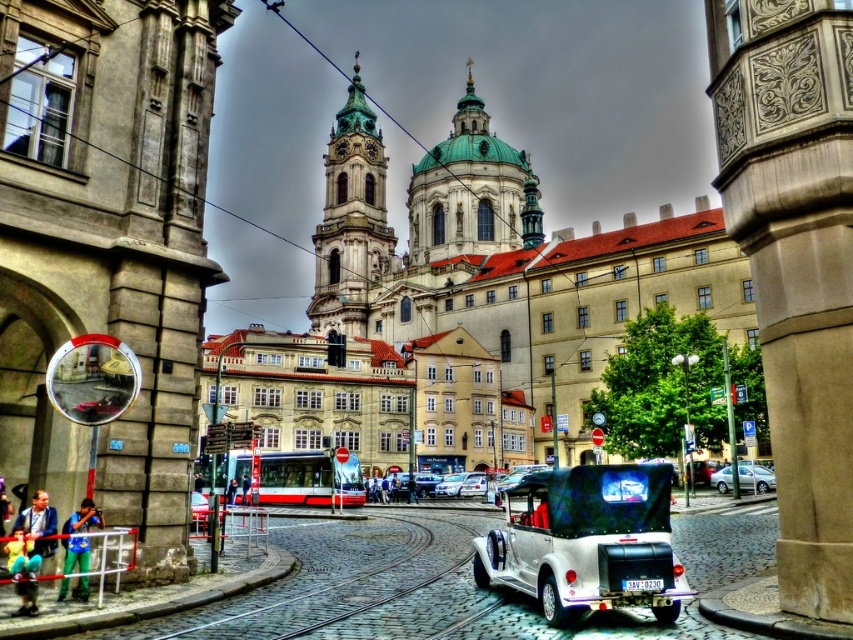
Question: Which is nearer to the silver metallic sedan at lower right?

Choices:
 (A) green glazed tile dome at center
 (B) brown textured pillar at center right

Answer: (B)

Question: Can you confirm if metallic silver car at center is positioned to the left of silver metallic sedan at lower right?

Choices:
 (A) no
 (B) yes

Answer: (B)

Question: Does metallic silver car at center have a greater width compared to green glazed tile bell tower at center?

Choices:
 (A) no
 (B) yes

Answer: (A)

Question: Among these objects, which one is nearest to the camera?

Choices:
 (A) green glazed tile bell tower at center
 (B) silver metallic sedan at lower right

Answer: (B)

Question: Which point is farther to the camera?

Choices:
 (A) metallic silver car at center
 (B) green glazed tile bell tower at center
 (C) brown textured pillar at center right

Answer: (B)

Question: Where is brown textured pillar at center right located in relation to green glazed tile dome at center in the image?

Choices:
 (A) right
 (B) left

Answer: (A)